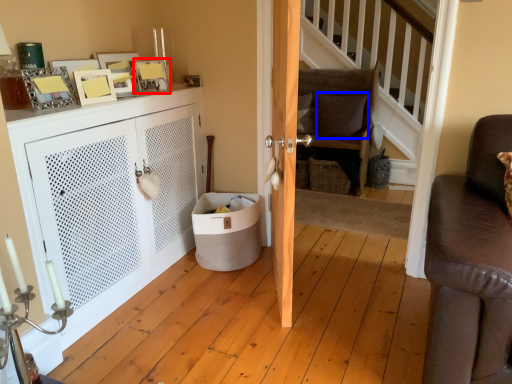
Question: Which of the following is the farthest to the observer, picture frame (highlighted by a red box) or pillow (highlighted by a blue box)?

Choices:
 (A) picture frame
 (B) pillow

Answer: (B)